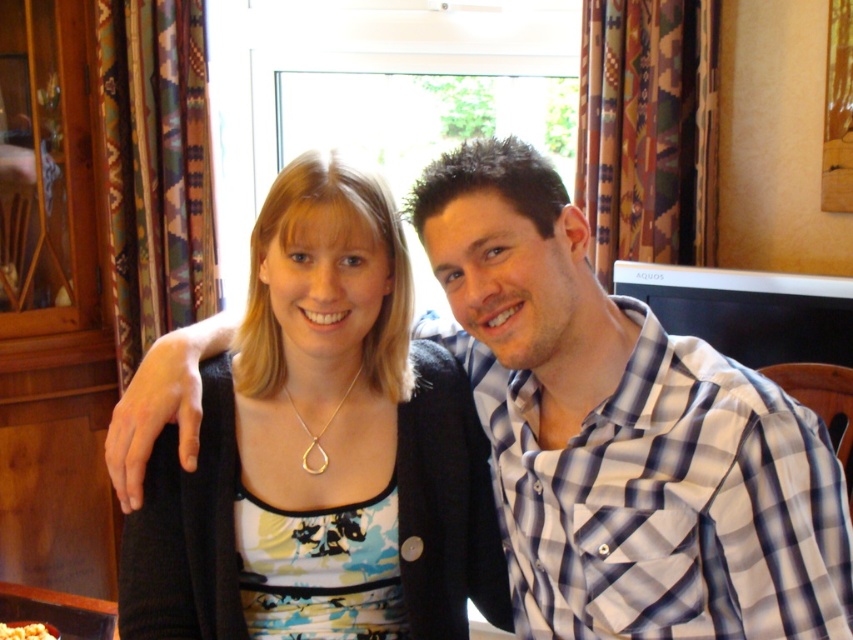
You are a tailor measuring the width of the matte black cardigan at center and the white crumbly food at center. Which object is wider?

The matte black cardigan at center is wider than the white crumbly food at center.

You are a delivery person who just arrived at the address. You see the matte black cardigan at center and the white crumbly food at center in the living room. The delivery requires placing the package between these two items. Is there enough space to fit the package, which is 30 inches long?

The distance between the matte black cardigan at center and the white crumbly food at center is 35.27 inches. Since the package is 30 inches long, there is enough space to place it between them.